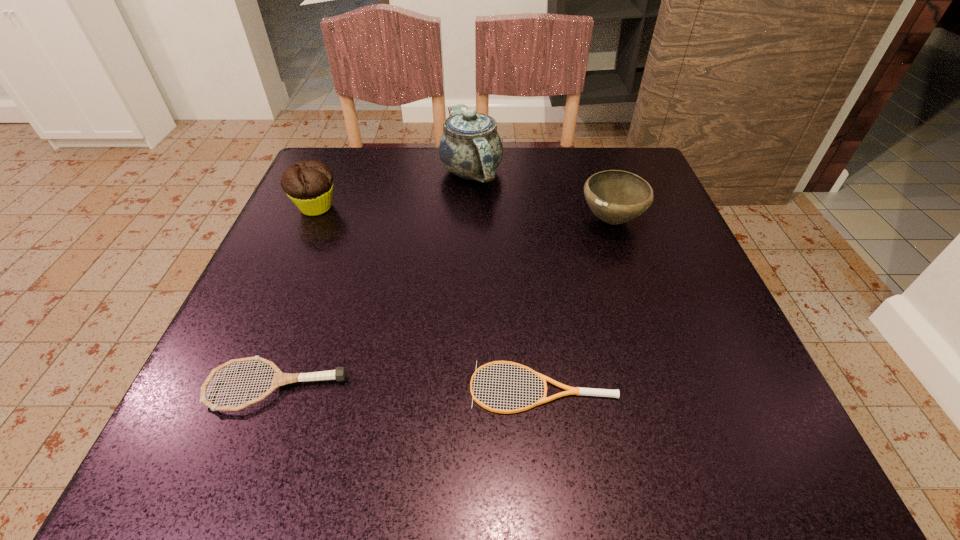
Identify which object is located as the nearest to the bowl. Please provide its 2D coordinates. Your answer should be formatted as a tuple, i.e. [(x, y)], where the tuple contains the x and y coordinates of a point satisfying the conditions above.

[(470, 147)]

At what (x,y) coordinates should I click in order to perform the action: click on free region that satisfies the following two spatial constraints: 1. on the front side of the shortest object; 2. on the right side of the second tallest object. Please return your answer as a coordinate pair (x, y). The width and height of the screenshot is (960, 540). Looking at the image, I should click on (236, 387).

Locate an element on the screen. This screenshot has height=540, width=960. free space that satisfies the following two spatial constraints: 1. from the spout of the chinaware; 2. on the left side of the rightmost object is located at coordinates point(469,220).

In order to click on free point that satisfies the following two spatial constraints: 1. on the front side of the right tennis racket; 2. on the right side of the left tennis racket in this screenshot , I will do `click(276, 387)`.

Locate an element on the screen. vacant area that satisfies the following two spatial constraints: 1. on the front side of the muffin; 2. on the right side of the shorter tennis racket is located at coordinates (236, 387).

Find the location of a particular element. This screenshot has width=960, height=540. blank space that satisfies the following two spatial constraints: 1. on the back side of the bowl; 2. on the left side of the taller tennis racket is located at coordinates [338, 220].